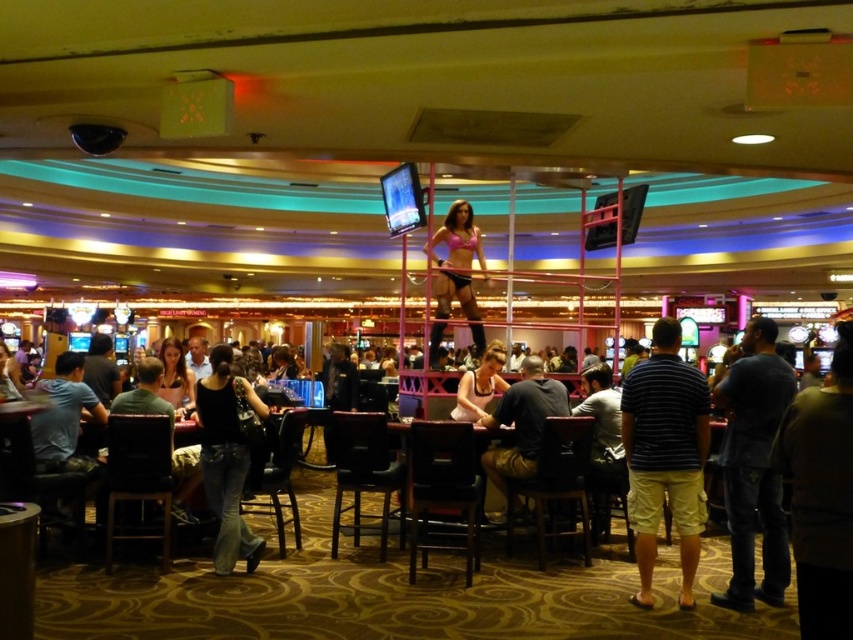
Question: Is pink fabric bikini at center positioned at the back of matte black dress at center?

Choices:
 (A) no
 (B) yes

Answer: (B)

Question: Does pink fabric bikini at center appear on the right side of matte black dress at center?

Choices:
 (A) yes
 (B) no

Answer: (A)

Question: Estimate the real-world distances between objects in this image. Which object is farther from the pink fabric bikini at center?

Choices:
 (A) matte pink bikini top at center
 (B) matte black dress at center

Answer: (B)

Question: Which is nearer to the pink fabric bikini at center?

Choices:
 (A) matte black dress at center
 (B) matte pink bikini top at center

Answer: (B)

Question: Which point appears closest to the camera in this image?

Choices:
 (A) (451, 234)
 (B) (187, 372)

Answer: (B)

Question: Where is matte black dress at center located in relation to matte pink bikini top at center in the image?

Choices:
 (A) left
 (B) right

Answer: (A)